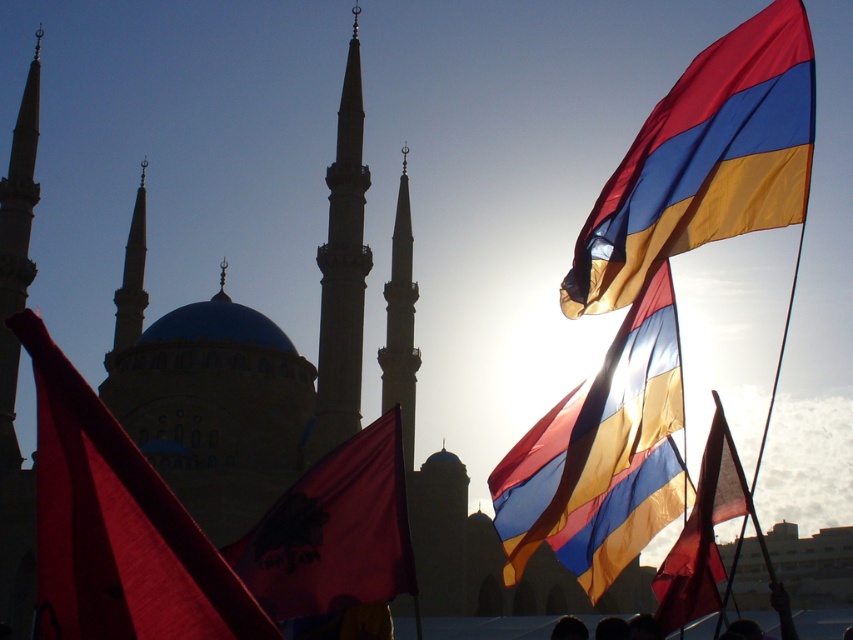
Question: Among these objects, which one is nearest to the camera?

Choices:
 (A) dark red fabric flag at center
 (B) matte red flag at left

Answer: (B)

Question: Can you confirm if silky blue and yellow flag at upper right is positioned to the right of matte red flag at center?

Choices:
 (A) no
 (B) yes

Answer: (A)

Question: Which point appears farthest from the camera in this image?

Choices:
 (A) (96, 561)
 (B) (582, 518)
 (C) (712, 572)
 (D) (387, 484)

Answer: (C)

Question: Does matte blue and gold flag at upper right appear over silky blue and yellow flag at upper right?

Choices:
 (A) no
 (B) yes

Answer: (B)

Question: Can you confirm if matte red flag at left is positioned to the left of dark red fabric flag at center?

Choices:
 (A) no
 (B) yes

Answer: (B)

Question: Which of the following is the farthest from the observer?

Choices:
 (A) matte red flag at center
 (B) matte red flag at left
 (C) dark red fabric flag at center

Answer: (A)